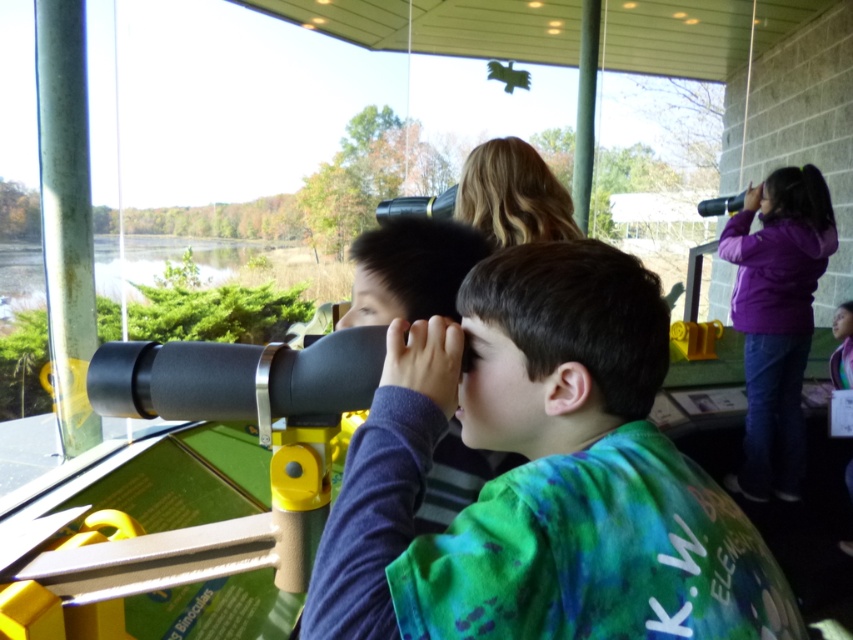
Question: Does purple fleece jacket at right appear on the right side of matte black binoculars at center?

Choices:
 (A) no
 (B) yes

Answer: (B)

Question: Is purple fleece jacket at right to the left of matte black binoculars at center from the viewer's perspective?

Choices:
 (A) no
 (B) yes

Answer: (A)

Question: Which point is closer to the camera?

Choices:
 (A) matte black binoculars at center
 (B) purple fleece jacket at right

Answer: (A)

Question: Does matte black telescope at center appear over matte black binoculars at center?

Choices:
 (A) no
 (B) yes

Answer: (A)

Question: Which of the following is the closest to the observer?

Choices:
 (A) matte black binoculars at center
 (B) purple fleece jacket at right

Answer: (A)

Question: Which of the following is the farthest from the observer?

Choices:
 (A) matte black binoculars at center
 (B) purple fleece jacket at right

Answer: (B)